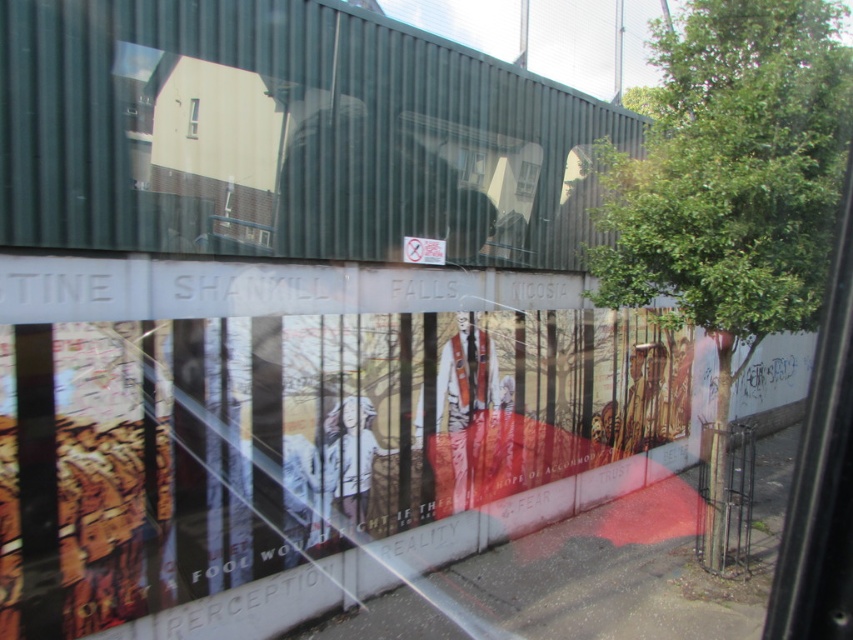
You are standing in a room looking through the clear glass window at upper center. You notice a green leafy tree at center reflected in the window. Which object appears larger in the reflection?

The green leafy tree at center appears larger than the clear glass window at upper center in the reflection because it is bigger in size.

From the picture: You are standing in a room looking through the clear glass window at upper center. You notice a green leafy tree at center reflected in the window. Which object appears taller in the reflection?

The green leafy tree at center appears taller in the reflection than the clear glass window at upper center because the description states it is much taller.